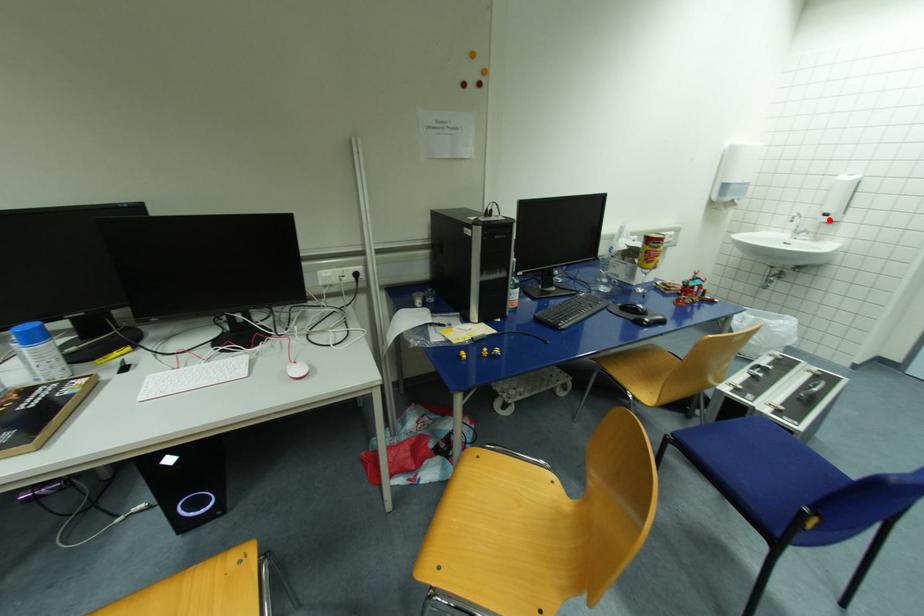
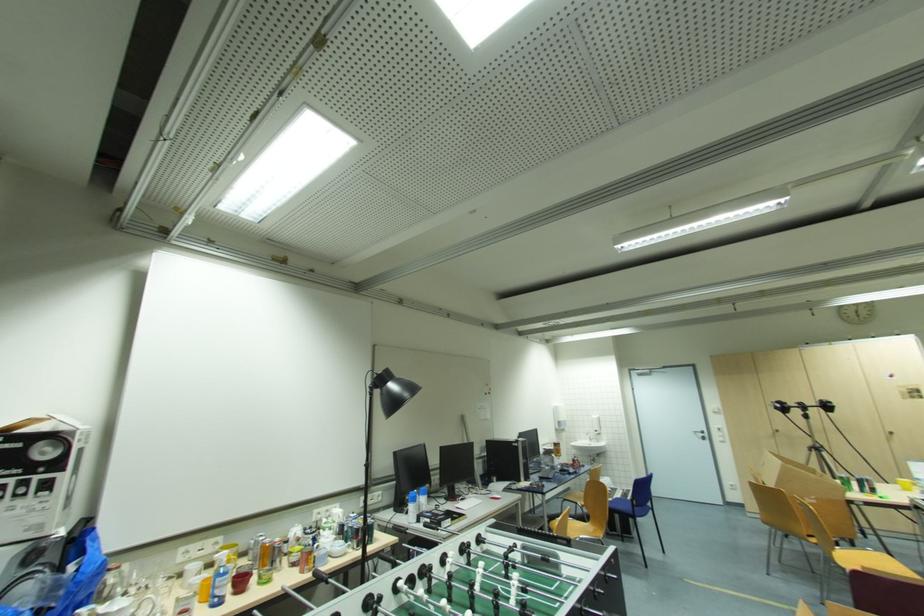
Locate, in the second image, the point that corresponds to the highlighted location in the first image.

(601, 434)